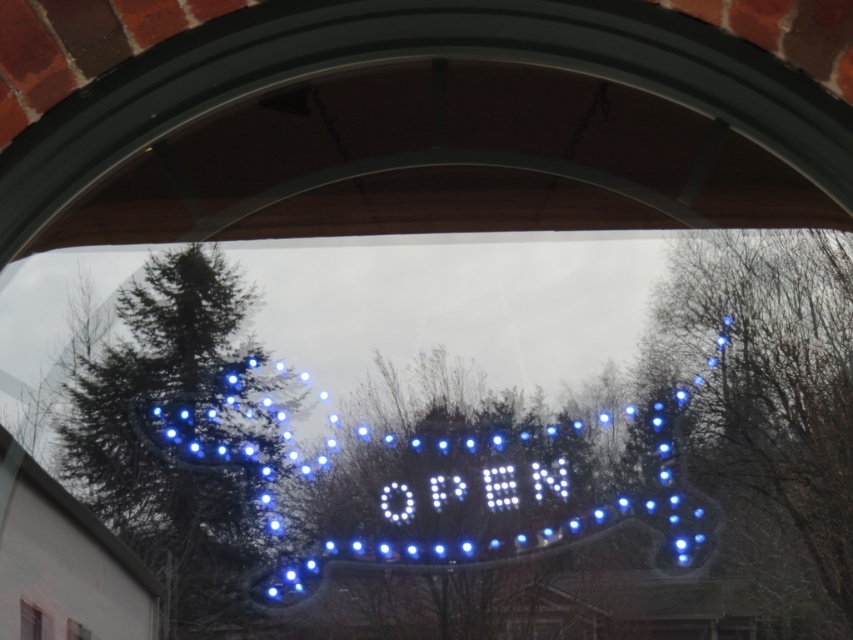
Between blue illuminated sign at center and transparent glass window at center, which one has less height?

Standing shorter between the two is transparent glass window at center.

Who is lower down, blue illuminated sign at center or transparent glass window at center?

transparent glass window at center is lower down.

What do you see at coordinates (489, 492) in the screenshot? I see `blue illuminated sign at center` at bounding box center [489, 492].

The width and height of the screenshot is (853, 640). What are the coordinates of `blue illuminated sign at center` in the screenshot? It's located at tap(489, 492).